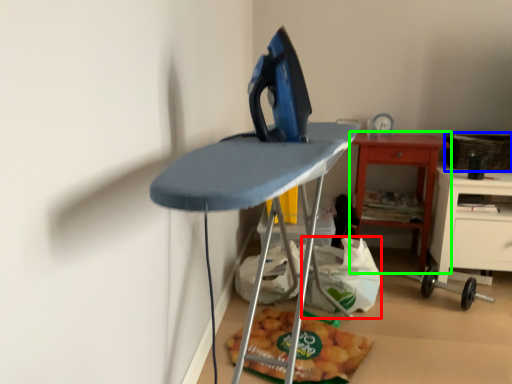
Question: Based on their relative distances, which object is nearer to grocery bag (highlighted by a red box)? Choose from basket (highlighted by a blue box) and table (highlighted by a green box).

Choices:
 (A) basket
 (B) table

Answer: (B)